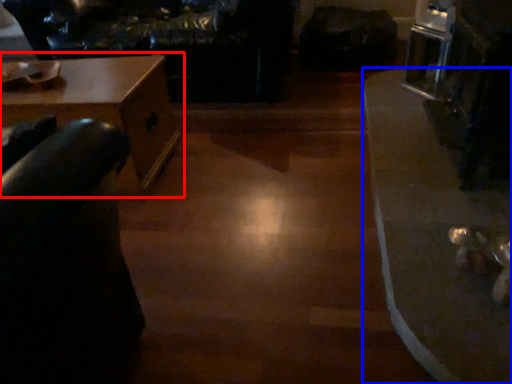
Question: Which object is further to the camera taking this photo, table (highlighted by a red box) or table (highlighted by a blue box)?

Choices:
 (A) table
 (B) table

Answer: (A)